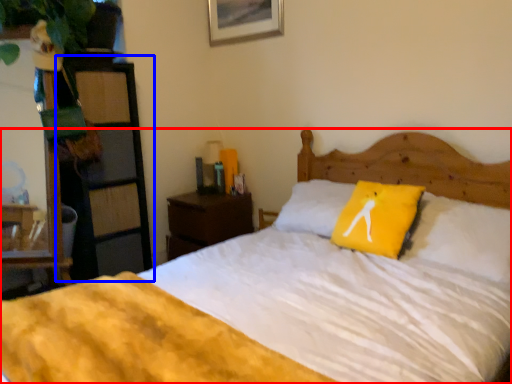
Question: Among these objects, which one is farthest to the camera, bed (highlighted by a red box) or dresser (highlighted by a blue box)?

Choices:
 (A) bed
 (B) dresser

Answer: (B)